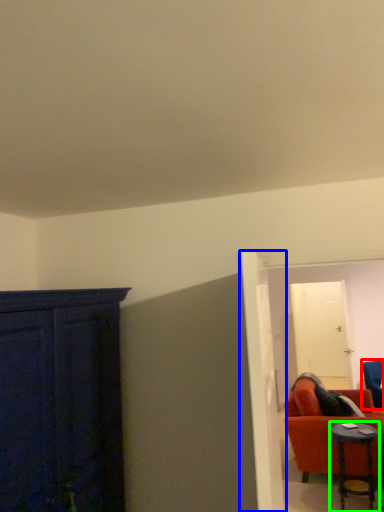
Question: Based on their relative distances, which object is nearer to chair (highlighted by a red box)? Choose from door (highlighted by a blue box) and table (highlighted by a green box).

Choices:
 (A) door
 (B) table

Answer: (B)